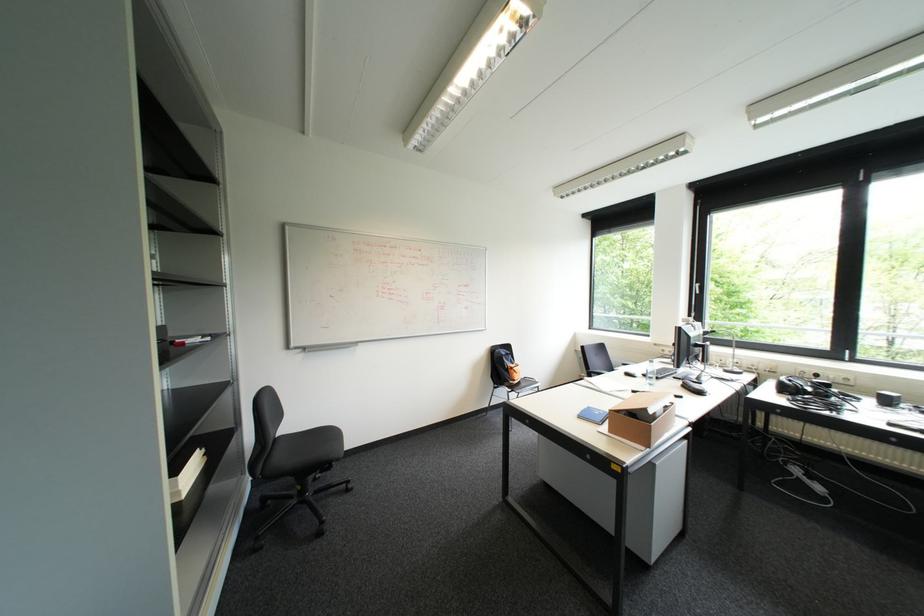
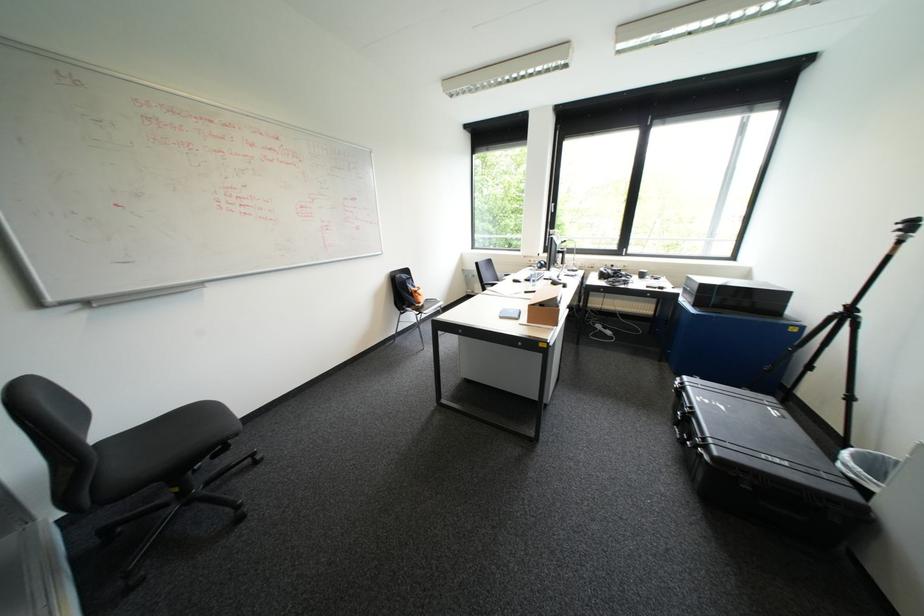
Consider the image. Based on the continuous images, in which direction is the camera rotating?

The camera's rotation is toward right-down.